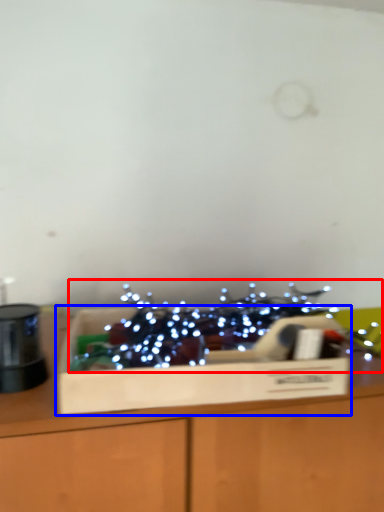
Question: Which point is further to the camera, christmas decoration (highlighted by a red box) or cardboard box (highlighted by a blue box)?

Choices:
 (A) christmas decoration
 (B) cardboard box

Answer: (B)